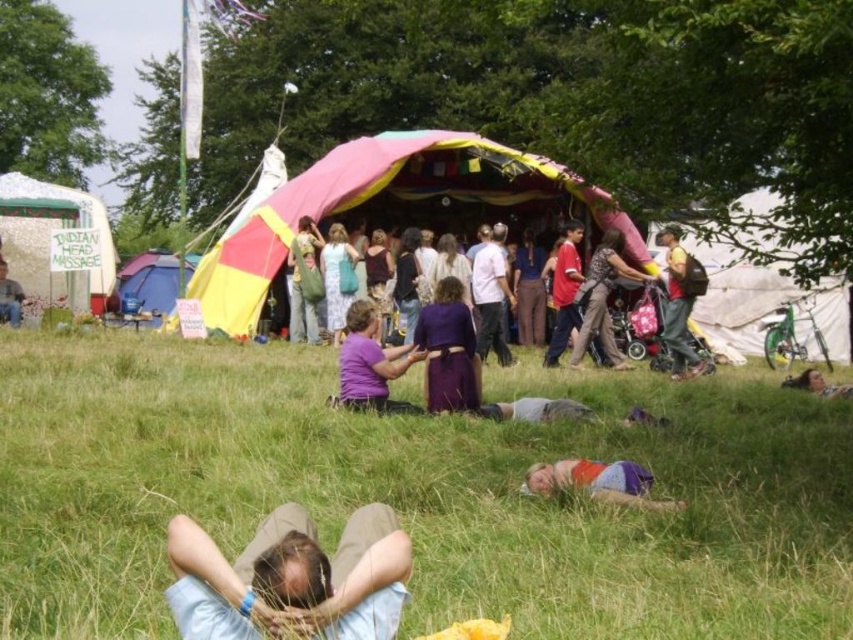
You are organizing a small event and need to decide which item to place on a narrow shelf. The shelf can only accommodate items up to the width of the green fabric bag at center. Do you think the purple matte shirt at center will fit on the shelf?

The purple matte shirt at center is wider than the green fabric bag at center, so it will not fit on the shelf designed for the green fabric bag at center.

You are planning to set up a small tent for a picnic and need to choose between placing it on the green grass at lower center or the matte yellow backpack at right. Based on the size of the two areas, which location would provide more space for your tent?

The green grass at lower center has a larger size compared to the matte yellow backpack at right, so placing the tent on the green grass at lower center would provide more space for your tent.